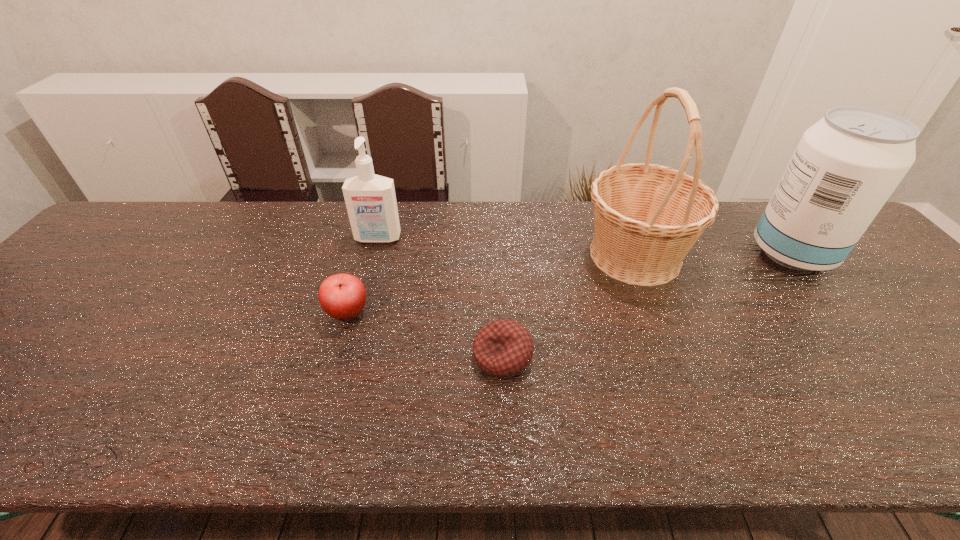
Where is `the tallest object`? The image size is (960, 540). the tallest object is located at coordinates (647, 217).

Where is `the second object from right to left`? This screenshot has width=960, height=540. the second object from right to left is located at coordinates click(x=647, y=217).

Identify the location of the rightmost object. (846, 166).

Where is `the fourth shortest object`? Image resolution: width=960 pixels, height=540 pixels. the fourth shortest object is located at coordinates (846, 166).

At what (x,y) coordinates should I click in order to perform the action: click on the third shortest object. Please return your answer as a coordinate pair (x, y). Looking at the image, I should click on (370, 199).

Identify the location of the fourth tallest object. Image resolution: width=960 pixels, height=540 pixels. (342, 296).

Identify the location of apple. (342, 296).

Locate an element on the screen. the third object from left to right is located at coordinates (502, 348).

You are a GUI agent. You are given a task and a screenshot of the screen. Output one action in this format:
    pyautogui.click(x=<x>, y=<y>)
    Task: Click on the shortest object
    This screenshot has height=540, width=960.
    Given the screenshot: What is the action you would take?
    pyautogui.click(x=502, y=348)

Locate an element on the screen. The height and width of the screenshot is (540, 960). vacant area located 0.110m on the back of the tallest object is located at coordinates (614, 202).